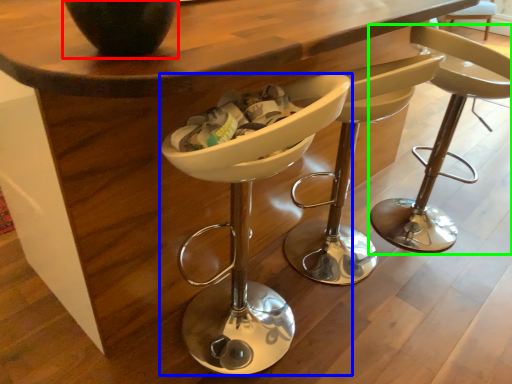
Question: Considering the real-world distances, which object is farthest from vase (highlighted by a red box)? chair (highlighted by a blue box) or chair (highlighted by a green box)?

Choices:
 (A) chair
 (B) chair

Answer: (B)